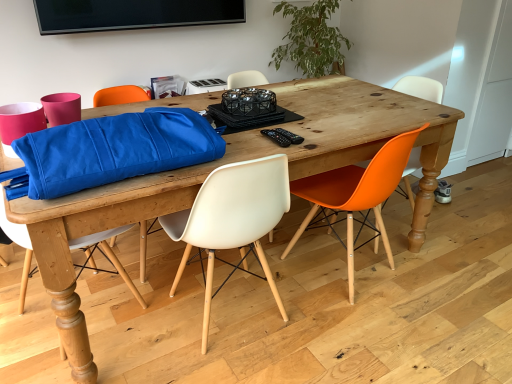
Question: Considering the positions of black plastic remote control at center, acting as the second remote control starting from the left, and green leafy plant at upper center in the image, is black plastic remote control at center, acting as the second remote control starting from the left, taller or shorter than green leafy plant at upper center?

Choices:
 (A) short
 (B) tall

Answer: (A)

Question: From the image's perspective, is black plastic remote control at center, acting as the second remote control starting from the left, located above or below green leafy plant at upper center?

Choices:
 (A) above
 (B) below

Answer: (B)

Question: Which object is the farthest from the white plastic chair at center, which is counted as the third chair, starting from the right?

Choices:
 (A) black plastic remote control at center, which is the 2th remote control in right-to-left order
 (B) orange matte plastic chair at right, which is the second chair from right to left
 (C) orange matte plastic chair at right, marked as the fourth chair in a left-to-right arrangement
 (D) green leafy plant at upper center
 (E) white plastic chair at center, which is the fourth chair from right to left

Answer: (D)

Question: Considering the real-world distances, which object is farthest from the black plastic remote control at center, which is the 2th remote control in right-to-left order?

Choices:
 (A) white plastic chair at center, the first chair from the left
 (B) wooden table at center
 (C) green leafy plant at upper center
 (D) white plastic chair at center, which is counted as the third chair, starting from the right
 (E) orange matte plastic chair at right, which is the 1th chair from right to left

Answer: (C)